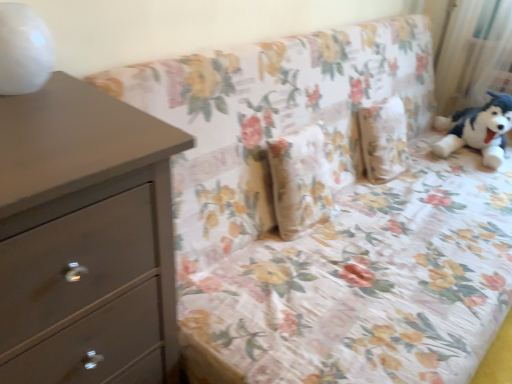
Question: Do you think matte gray chest of drawers at left is within white sheer curtain at upper right, or outside of it?

Choices:
 (A) inside
 (B) outside

Answer: (B)

Question: Considering the positions of matte gray chest of drawers at left and white sheer curtain at upper right in the image, is matte gray chest of drawers at left bigger or smaller than white sheer curtain at upper right?

Choices:
 (A) big
 (B) small

Answer: (A)

Question: Is matte gray chest of drawers at left to the left or to the right of white sheer curtain at upper right in the image?

Choices:
 (A) left
 (B) right

Answer: (A)

Question: Considering the positions of white sheer curtain at upper right and matte gray chest of drawers at left in the image, is white sheer curtain at upper right wider or thinner than matte gray chest of drawers at left?

Choices:
 (A) thin
 (B) wide

Answer: (A)

Question: Is white sheer curtain at upper right to the left or to the right of matte gray chest of drawers at left in the image?

Choices:
 (A) left
 (B) right

Answer: (B)

Question: Does point (459, 19) appear closer or farther from the camera than point (145, 345)?

Choices:
 (A) farther
 (B) closer

Answer: (A)

Question: From the image's perspective, is white sheer curtain at upper right above or below matte gray chest of drawers at left?

Choices:
 (A) below
 (B) above

Answer: (B)